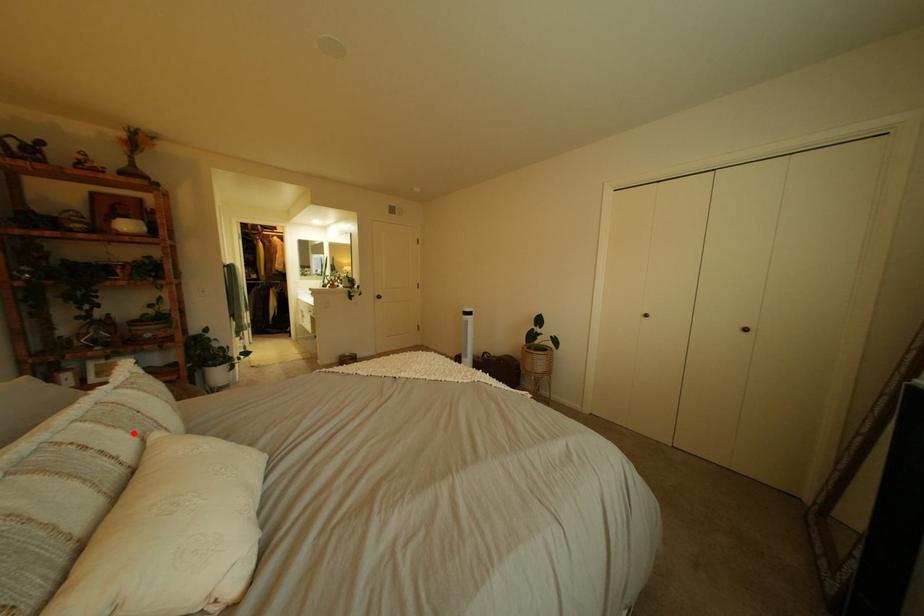
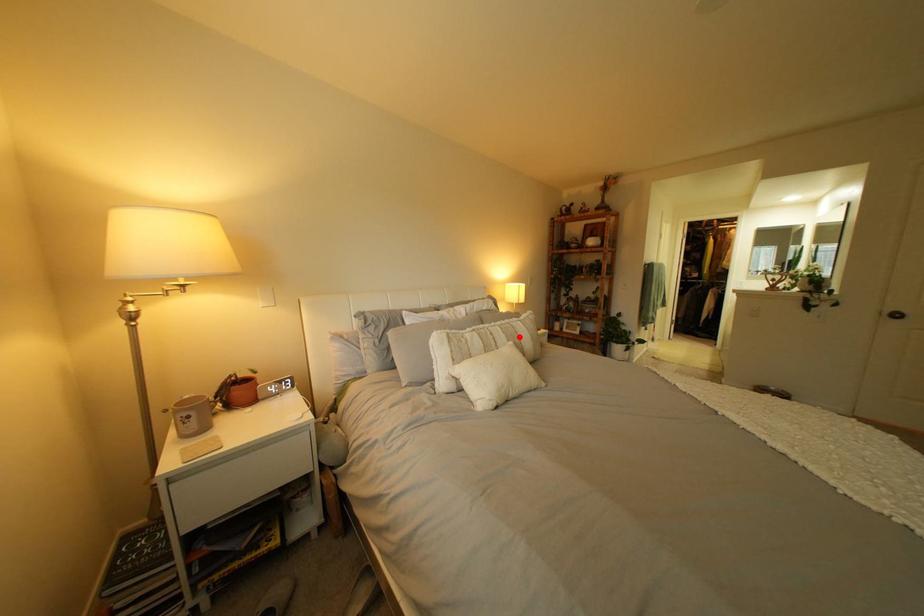
I am providing you with two images of the same scene from different viewpoints. A red point is marked on the first image and another point is marked on the second image. Is the marked point in image1 the same physical position as the marked point in image2?

Yes